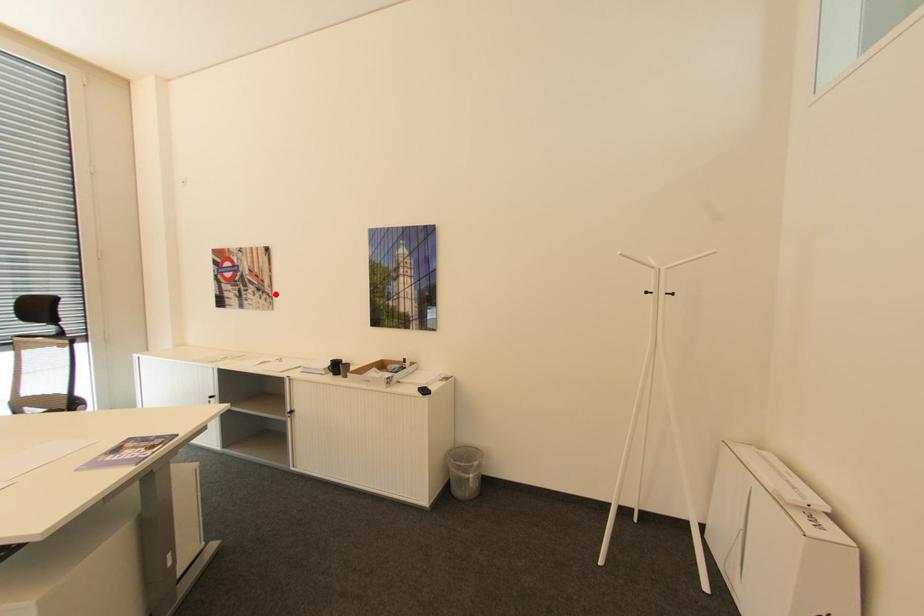
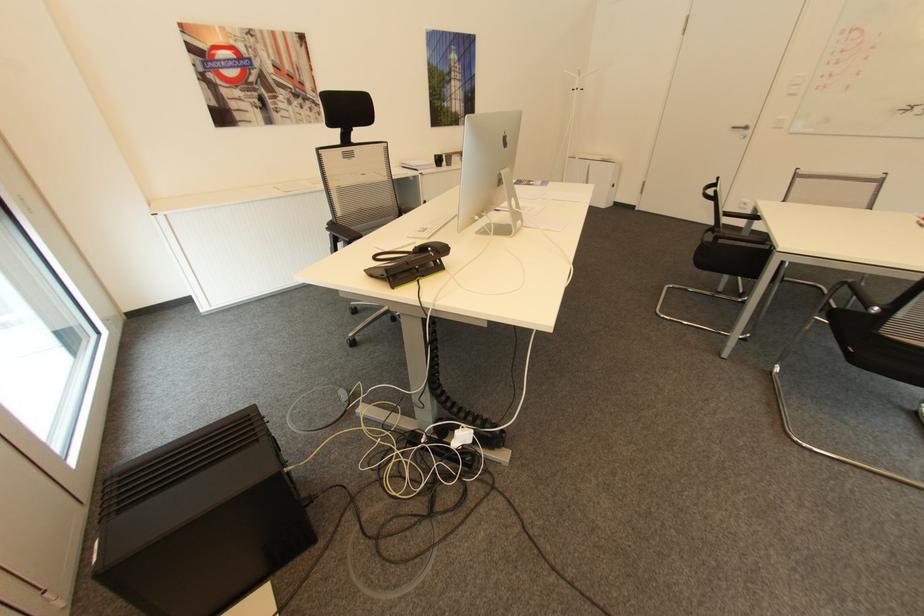
In the second image, find the point that corresponds to the highlighted location in the first image.

(322, 102)